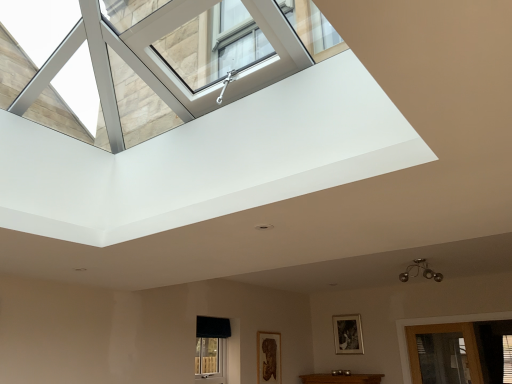
This screenshot has height=384, width=512. What are the coordinates of `transparent glass door at lower right` in the screenshot? It's located at (430, 332).

What do you see at coordinates (269, 357) in the screenshot?
I see `wooden carved frame at lower center, positioned as the second picture frame in right-to-left order` at bounding box center [269, 357].

What is the approximate height of wooden carved frame at lower center, positioned as the 1th picture frame in front-to-back order?

The height of wooden carved frame at lower center, positioned as the 1th picture frame in front-to-back order, is 25.65 inches.

How much space does wooden picture frame at center, the 1th picture frame positioned from the back, occupy horizontally?

wooden picture frame at center, the 1th picture frame positioned from the back, is 6.11 centimeters wide.

Where is `black fabric window at lower center`? Image resolution: width=512 pixels, height=384 pixels. black fabric window at lower center is located at coordinates (211, 348).

Does wooden picture frame at center, acting as the 1th picture frame starting from the right, have a greater height compared to wooden carved frame at lower center, arranged as the second picture frame when viewed from the back?

No.

Is wooden picture frame at center, acting as the 1th picture frame starting from the right, looking in the opposite direction of wooden carved frame at lower center, positioned as the second picture frame in right-to-left order?

wooden picture frame at center, acting as the 1th picture frame starting from the right, does not have its back to wooden carved frame at lower center, positioned as the second picture frame in right-to-left order.

Looking at this image, which is more to the right, wooden picture frame at center, positioned as the second picture frame in front-to-back order, or wooden carved frame at lower center, marked as the first picture frame in a left-to-right arrangement?

Positioned to the right is wooden picture frame at center, positioned as the second picture frame in front-to-back order.

From the picture: From the image's perspective, is wooden picture frame at center, the 1th picture frame positioned from the back, above wooden carved frame at lower center, marked as the first picture frame in a left-to-right arrangement?

Yes, from the image's perspective, wooden picture frame at center, the 1th picture frame positioned from the back, is over wooden carved frame at lower center, marked as the first picture frame in a left-to-right arrangement.

From the image's perspective, which one is positioned higher, transparent glass door at lower right or black fabric window at lower center?

black fabric window at lower center is shown above in the image.

Considering the points (488, 317) and (217, 336), which point is behind, point (488, 317) or point (217, 336)?

The point (488, 317) is farther from the camera.

Considering the sizes of objects transparent glass door at lower right and black fabric window at lower center in the image provided, who is taller, transparent glass door at lower right or black fabric window at lower center?

Standing taller between the two is black fabric window at lower center.

Which is more to the left, transparent glass door at lower right or black fabric window at lower center?

From the viewer's perspective, black fabric window at lower center appears more on the left side.

Which of these two, transparent glass door at lower right or wooden carved frame at lower center, positioned as the 1th picture frame in front-to-back order, stands taller?

transparent glass door at lower right is taller.

Is transparent glass door at lower right positioned far away from wooden carved frame at lower center, positioned as the 1th picture frame in front-to-back order?

A: Absolutely, transparent glass door at lower right is distant from wooden carved frame at lower center, positioned as the 1th picture frame in front-to-back order.

Is transparent glass door at lower right positioned in front of wooden carved frame at lower center, positioned as the 1th picture frame in front-to-back order?

That is True.

Is there a large distance between wooden picture frame at center, acting as the 1th picture frame starting from the right, and transparent glass door at lower right?

No, wooden picture frame at center, acting as the 1th picture frame starting from the right, is not far from transparent glass door at lower right.

Considering the positions of point (336, 352) and point (408, 356), is point (336, 352) closer or farther from the camera than point (408, 356)?

Point (336, 352) is positioned farther from the camera compared to point (408, 356).

This screenshot has width=512, height=384. I want to click on picture frame above the transparent glass door at lower right (from a real-world perspective), so click(348, 334).

Between wooden carved frame at lower center, marked as the first picture frame in a left-to-right arrangement, and black fabric window at lower center, which one appears on the left side from the viewer's perspective?

A: Positioned to the left is black fabric window at lower center.

Which point is more forward, (x=262, y=364) or (x=209, y=334)?

The point (x=209, y=334) is in front.

Where is `window located in front of the wooden carved frame at lower center, positioned as the 1th picture frame in front-to-back order`? window located in front of the wooden carved frame at lower center, positioned as the 1th picture frame in front-to-back order is located at coordinates point(211,348).

Does point (205, 375) lie behind point (341, 321)?

That is False.

You are a GUI agent. You are given a task and a screenshot of the screen. Output one action in this format:
    pyautogui.click(x=<x>, y=<y>)
    Task: Click on the window that is on the left side of wooden picture frame at center, positioned as the second picture frame in front-to-back order
    This screenshot has width=512, height=384.
    Given the screenshot: What is the action you would take?
    pyautogui.click(x=211, y=348)

From a real-world perspective, is black fabric window at lower center positioned above or below wooden picture frame at center, acting as the 1th picture frame starting from the right?

black fabric window at lower center is situated lower than wooden picture frame at center, acting as the 1th picture frame starting from the right, in the real world.

From their relative heights in the image, would you say transparent glass door at lower right is taller or shorter than wooden picture frame at center, the 1th picture frame positioned from the back?

In the image, transparent glass door at lower right appears to be taller than wooden picture frame at center, the 1th picture frame positioned from the back.

From the image's perspective, does transparent glass door at lower right appear higher than wooden picture frame at center, positioned as the second picture frame in front-to-back order?

No, from the image's perspective, transparent glass door at lower right is not on top of wooden picture frame at center, positioned as the second picture frame in front-to-back order.

Choose the correct answer: Is transparent glass door at lower right inside wooden picture frame at center, arranged as the second picture frame when viewed from the left, or outside it?

transparent glass door at lower right is not inside wooden picture frame at center, arranged as the second picture frame when viewed from the left, it's outside.

Is transparent glass door at lower right next to wooden picture frame at center, the 1th picture frame positioned from the back?

No, transparent glass door at lower right is not with wooden picture frame at center, the 1th picture frame positioned from the back.

The height and width of the screenshot is (384, 512). Identify the location of picture frame that appears above the wooden carved frame at lower center, positioned as the second picture frame in right-to-left order (from the image's perspective). (348, 334).

The image size is (512, 384). What are the coordinates of `glass door behind the black fabric window at lower center` in the screenshot? It's located at (430, 332).

Based on their spatial positions, is transparent glass door at lower right or wooden picture frame at center, the 1th picture frame positioned from the back, further from wooden carved frame at lower center, positioned as the 1th picture frame in front-to-back order?

transparent glass door at lower right is positioned further to the anchor wooden carved frame at lower center, positioned as the 1th picture frame in front-to-back order.

From the image, which object appears to be nearer to wooden picture frame at center, positioned as the second picture frame in front-to-back order, wooden carved frame at lower center, positioned as the second picture frame in right-to-left order, or transparent glass door at lower right?

transparent glass door at lower right.

Considering their positions, is wooden picture frame at center, arranged as the second picture frame when viewed from the left, positioned closer to transparent glass door at lower right than black fabric window at lower center?

wooden picture frame at center, arranged as the second picture frame when viewed from the left.

Looking at the image, which one is located closer to wooden picture frame at center, the 1th picture frame positioned from the back, black fabric window at lower center or transparent glass door at lower right?

transparent glass door at lower right.

From the image, which object appears to be farther from wooden carved frame at lower center, marked as the first picture frame in a left-to-right arrangement, wooden picture frame at center, positioned as the second picture frame in front-to-back order, or black fabric window at lower center?

wooden picture frame at center, positioned as the second picture frame in front-to-back order, is positioned further to the anchor wooden carved frame at lower center, marked as the first picture frame in a left-to-right arrangement.

Based on their spatial positions, is black fabric window at lower center or wooden carved frame at lower center, positioned as the 1th picture frame in front-to-back order, closer to wooden picture frame at center, the 1th picture frame positioned from the back?

wooden carved frame at lower center, positioned as the 1th picture frame in front-to-back order, is positioned closer to the anchor wooden picture frame at center, the 1th picture frame positioned from the back.

Looking at the image, which one is located closer to wooden picture frame at center, positioned as the second picture frame in front-to-back order, wooden carved frame at lower center, arranged as the second picture frame when viewed from the back, or black fabric window at lower center?

wooden carved frame at lower center, arranged as the second picture frame when viewed from the back, lies closer to wooden picture frame at center, positioned as the second picture frame in front-to-back order, than the other object.

From the image, which object appears to be farther from transparent glass door at lower right, black fabric window at lower center or wooden picture frame at center, the 1th picture frame positioned from the back?

black fabric window at lower center.

The image size is (512, 384). Find the location of `picture frame between black fabric window at lower center and wooden picture frame at center, the 1th picture frame positioned from the back, from left to right`. picture frame between black fabric window at lower center and wooden picture frame at center, the 1th picture frame positioned from the back, from left to right is located at coordinates (269, 357).

This screenshot has height=384, width=512. Identify the location of picture frame between wooden carved frame at lower center, arranged as the second picture frame when viewed from the back, and transparent glass door at lower right. (348, 334).